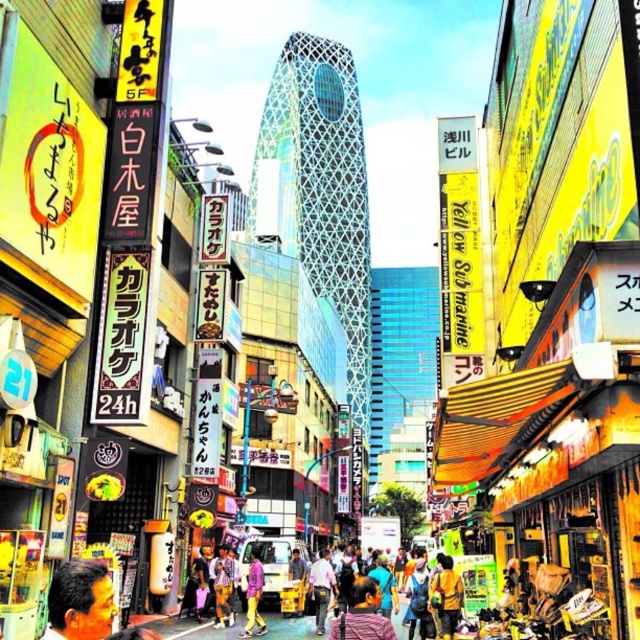
Question: Which is nearer to the purple matte shirt at center?

Choices:
 (A) denim jacket at center
 (B) orange hair at center

Answer: (B)

Question: Can you confirm if orange hair at center is positioned to the right of purple matte shirt at center?

Choices:
 (A) no
 (B) yes

Answer: (B)

Question: Which point appears closest to the camera in this image?

Choices:
 (A) click(x=339, y=620)
 (B) click(x=253, y=556)

Answer: (A)

Question: Does orange hair at center appear on the left side of denim jacket at center?

Choices:
 (A) no
 (B) yes

Answer: (B)

Question: Which point is closer to the camera taking this photo?

Choices:
 (A) (440, 612)
 (B) (355, 620)
 (C) (252, 621)

Answer: (B)

Question: Does orange hair at center appear under denim jacket at center?

Choices:
 (A) yes
 (B) no

Answer: (A)